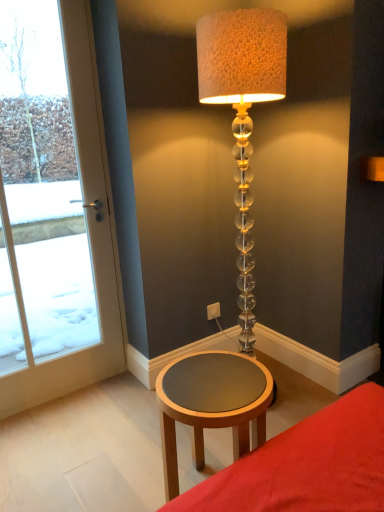
Where is `blank space situated above matte brown table at lower center (from a real-world perspective)`? blank space situated above matte brown table at lower center (from a real-world perspective) is located at coordinates (318, 453).